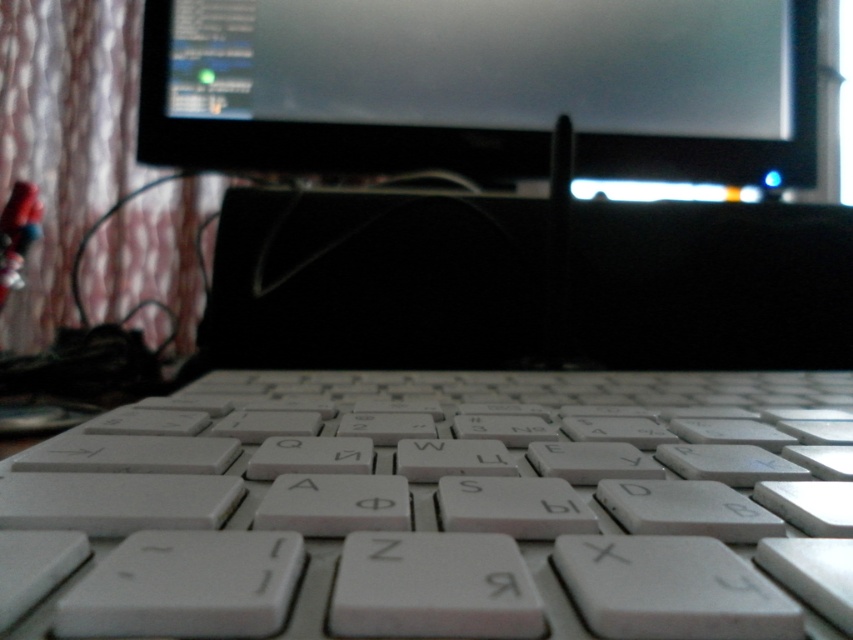
Question: Considering the relative positions of white plastic keyboard at center and black glossy monitor at upper center in the image provided, where is white plastic keyboard at center located with respect to black glossy monitor at upper center?

Choices:
 (A) above
 (B) below

Answer: (B)

Question: Which point is closer to the camera taking this photo?

Choices:
 (A) (228, 29)
 (B) (498, 572)

Answer: (B)

Question: Is white plastic keyboard at center thinner than black glossy monitor at upper center?

Choices:
 (A) no
 (B) yes

Answer: (B)

Question: Which object appears farthest from the camera in this image?

Choices:
 (A) white plastic keyboard at center
 (B) black glossy monitor at upper center

Answer: (B)

Question: Can you confirm if white plastic keyboard at center is positioned below black glossy monitor at upper center?

Choices:
 (A) no
 (B) yes

Answer: (B)